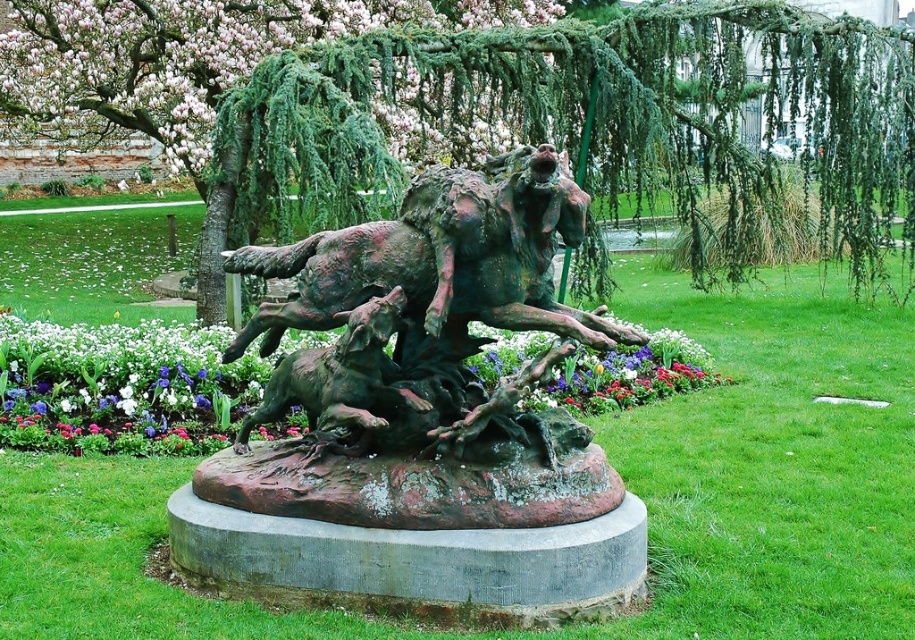
Does bronze textured dog at center appear on the left side of multicolored fabric flowers at center?

Correct, you'll find bronze textured dog at center to the left of multicolored fabric flowers at center.

Can you confirm if bronze textured dog at center is taller than multicolored fabric flowers at center?

Yes, bronze textured dog at center is taller than multicolored fabric flowers at center.

This screenshot has width=915, height=640. What do you see at coordinates (341, 376) in the screenshot? I see `bronze textured dog at center` at bounding box center [341, 376].

Find the location of `bronze textured dog at center`. bronze textured dog at center is located at coordinates (341, 376).

Can you confirm if matte green leaves at center is shorter than multicolored fabric flowers at center?

No.

Who is positioned more to the right, matte green leaves at center or multicolored fabric flowers at center?

multicolored fabric flowers at center

In order to click on matte green leaves at center in this screenshot , I will do `click(121, 387)`.

Can you confirm if rusty bronze horse at center is positioned to the right of multicolored fabric flowers at center?

Incorrect, rusty bronze horse at center is not on the right side of multicolored fabric flowers at center.

At what (x,y) coordinates should I click in order to perform the action: click on rusty bronze horse at center. Please return your answer as a coordinate pair (x, y). Looking at the image, I should click on (432, 365).